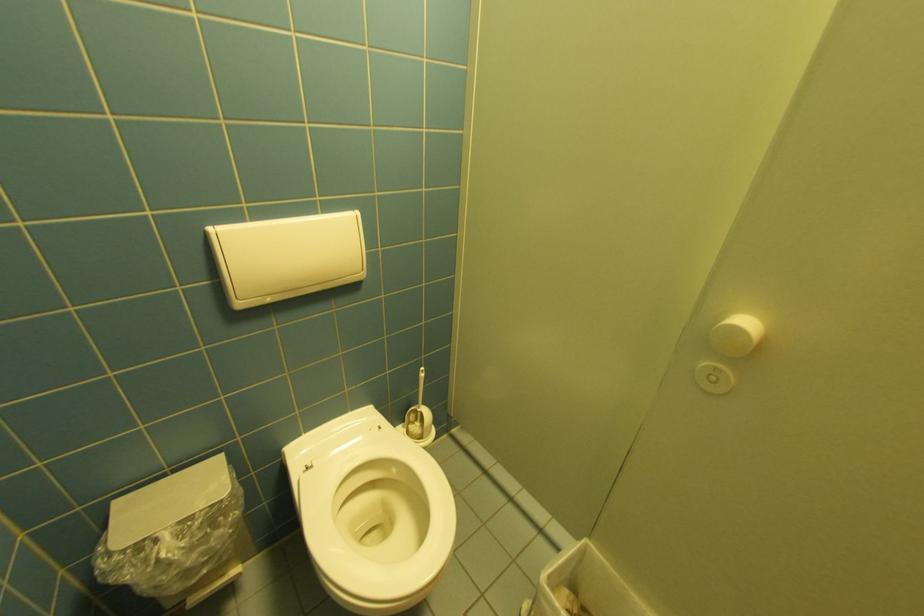
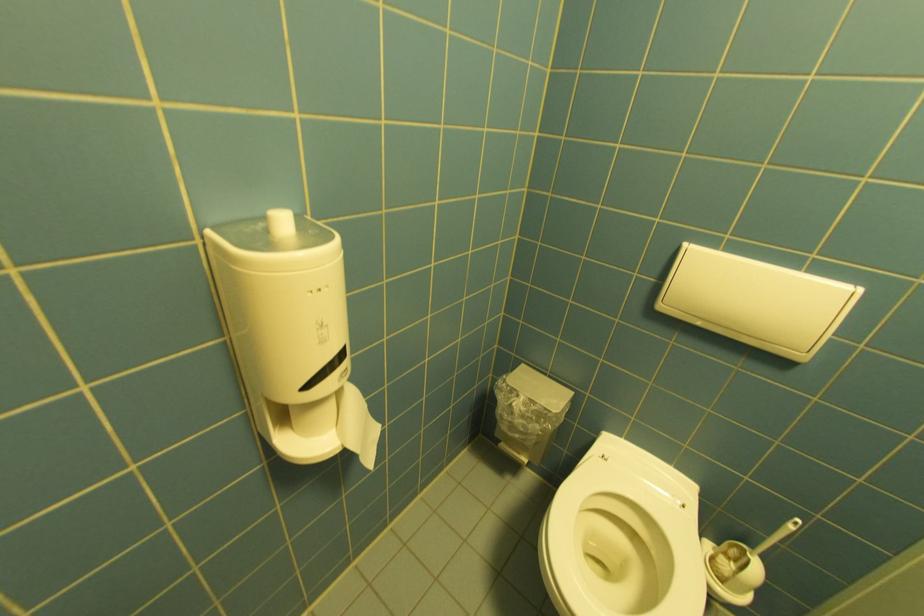
How did the camera likely rotate?

The camera rotated toward left-down.